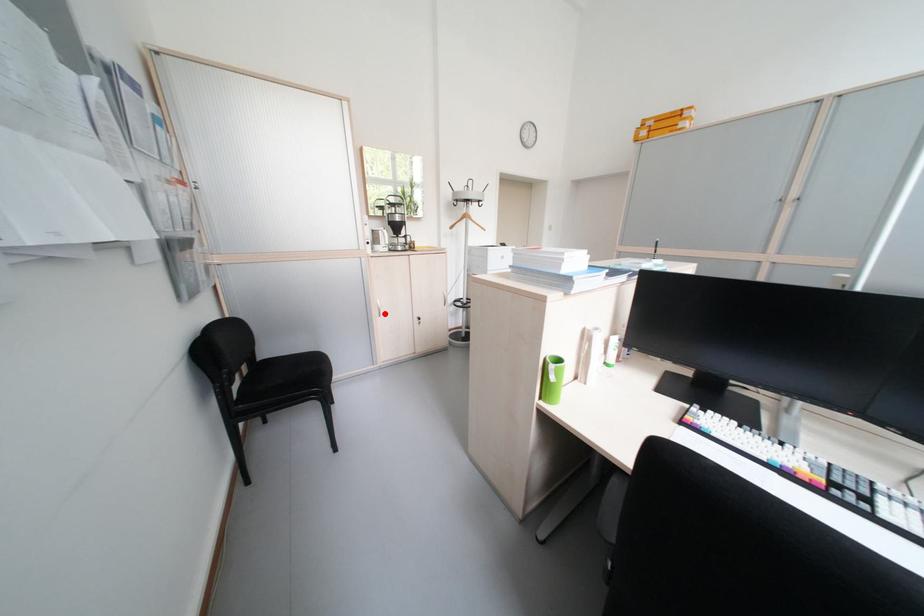
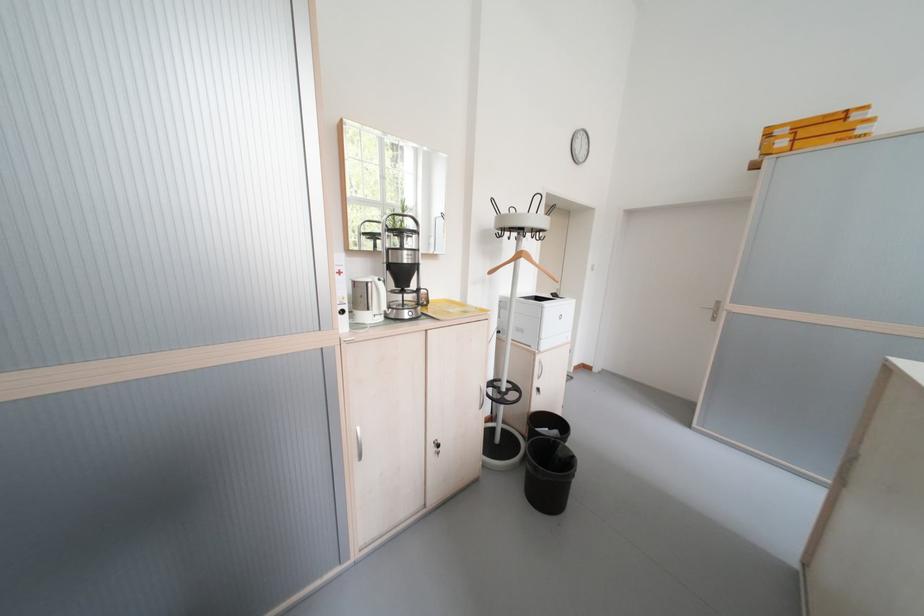
Where in the second image is the point corresponding to the highlighted location from the first image?

(359, 455)